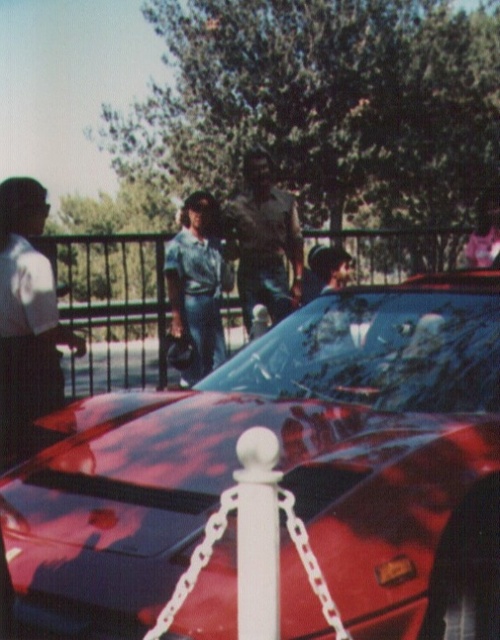
Does clear glass windshield at center have a lesser height compared to brown leather jacket at center?

Yes, clear glass windshield at center is shorter than brown leather jacket at center.

Does point (359, 371) lie in front of point (302, 262)?

That is True.

Does point (323, 349) come closer to viewer compared to point (287, 304)?

Yes, point (323, 349) is closer to viewer.

At what (x,y) coordinates should I click in order to perform the action: click on clear glass windshield at center. Please return your answer as a coordinate pair (x, y). The width and height of the screenshot is (500, 640). Looking at the image, I should click on (378, 352).

What do you see at coordinates (258, 534) in the screenshot? I see `white glossy pole at center` at bounding box center [258, 534].

Is white glossy pole at center smaller than denim jeans at center?

Yes, white glossy pole at center is smaller than denim jeans at center.

Locate an element on the screen. white glossy pole at center is located at coordinates (258, 534).

Looking at this image, how far apart are shiny red car at center and denim jeans at center?

shiny red car at center and denim jeans at center are 3.30 meters apart from each other.

Does point (439, 627) come behind point (220, 336)?

No, (439, 627) is in front of (220, 336).

Identify the location of shiny red car at center. (286, 470).